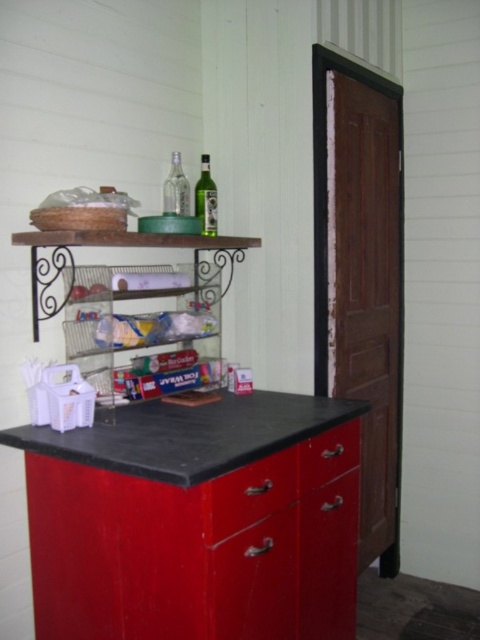
You are organizing items in the kitchen and need to place a large pot that requires a lot of space. Which object between the metallic wire shelf at upper left and the metallic red drawer at lower center would be more suitable for storing the pot?

The metallic wire shelf at upper left is larger in size than the metallic red drawer at lower center, so it would be more suitable for storing the large pot that requires a lot of space.

You are organizing items in the kitchen and need to place a new item between the metallic red drawer at lower center and the green glass bottle at upper center. Is there enough vertical space between them to fit a 10 cm tall object?

The metallic red drawer at lower center is below the green glass bottle at upper center, so there is vertical space between them. Since the object is only 10 cm tall, it should fit between them if the distance between the drawer and the bottle is at least 10 cm. However, the exact distance isn not specified, so we can only confirm that there is space available.

You are organizing the items in the kitchen pantry and need to place a new spice jar that requires a shelf space taller than 12 inches. Which drawer between the metallic red drawer at lower center and the matte red drawer at center would be suitable for placing the spice jar?

The matte red drawer at center is taller than the metallic red drawer at lower center. Since the spice jar requires a shelf space taller than 12 inches, you should check the matte red drawer at center first to see if it meets the height requirement.